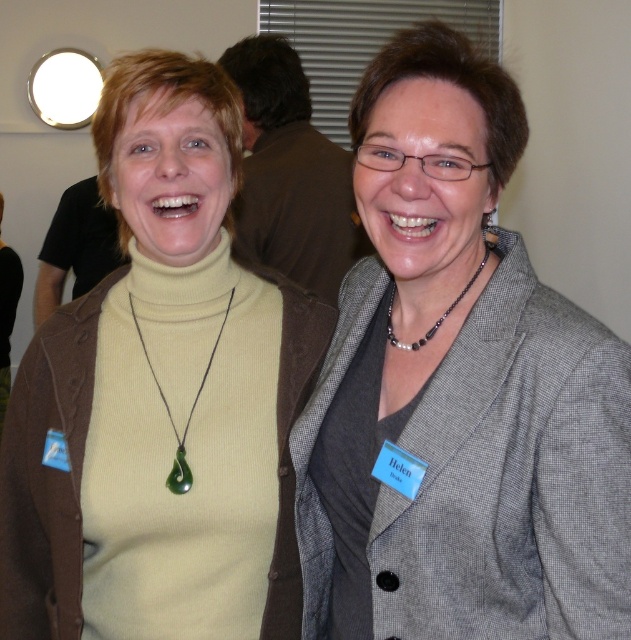
Which is in front, point (198, 394) or point (466, 291)?

Point (466, 291) is in front.

Which is below, green jade pendant at center or black beaded necklace at center?

Positioned lower is green jade pendant at center.

Is point (192, 410) positioned in front of point (386, 333)?

No, (192, 410) is further to viewer.

The height and width of the screenshot is (640, 631). In order to click on green jade pendant at center in this screenshot , I will do `click(189, 412)`.

Between matte green necklace at center and green jade pendant at center, which one appears on the right side from the viewer's perspective?

From the viewer's perspective, green jade pendant at center appears more on the right side.

Who is more distant from viewer, (175,81) or (184,429)?

Positioned behind is point (184,429).

Who is more forward, (8, 600) or (133, 312)?

Point (133, 312) is more forward.

This screenshot has width=631, height=640. Find the location of `matte green necklace at center`. matte green necklace at center is located at coordinates (160, 397).

Is matte green necklace at center further to camera compared to black beaded necklace at center?

Yes, matte green necklace at center is further from the viewer.

Is point (298, 368) in front of point (481, 268)?

No.

Does point (6, 522) lie behind point (387, 317)?

Yes, point (6, 522) is behind point (387, 317).

This screenshot has height=640, width=631. I want to click on matte green necklace at center, so click(160, 397).